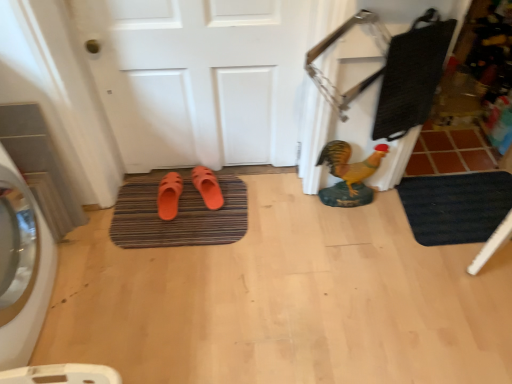
This screenshot has width=512, height=384. I want to click on free space underneath brown textured bath mat at center, marked as the first bath mat in a left-to-right arrangement (from a real-world perspective), so coord(176,226).